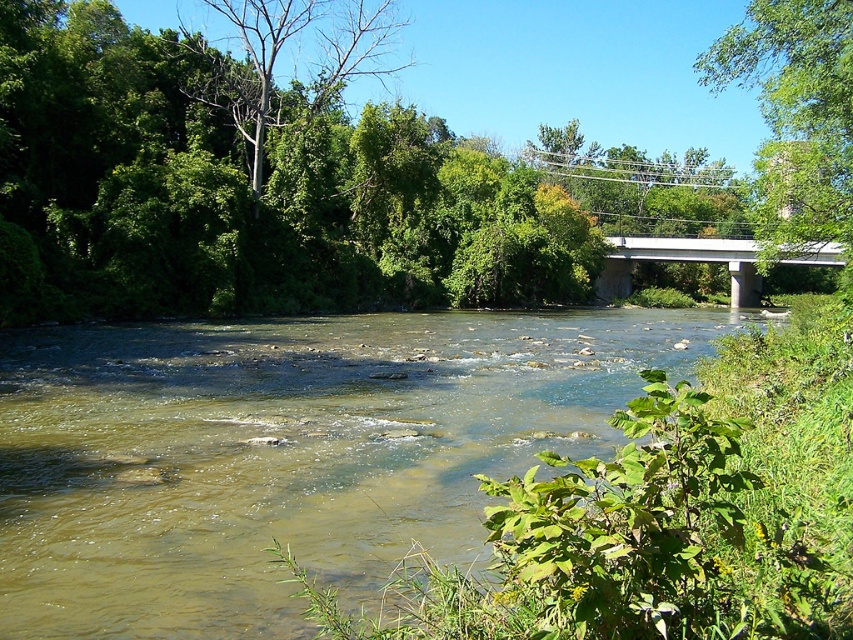
Question: Which point is closer to the camera taking this photo?

Choices:
 (A) (630, 248)
 (B) (610, 314)

Answer: (B)

Question: Which point is closer to the camera?

Choices:
 (A) white concrete bridge at upper center
 (B) brown sedimentary stream at center

Answer: (B)

Question: Is brown sedimentary stream at center below white concrete bridge at upper center?

Choices:
 (A) no
 (B) yes

Answer: (B)

Question: Does brown sedimentary stream at center appear on the left side of white concrete bridge at upper center?

Choices:
 (A) no
 (B) yes

Answer: (B)

Question: Can you confirm if brown sedimentary stream at center is positioned to the right of white concrete bridge at upper center?

Choices:
 (A) yes
 (B) no

Answer: (B)